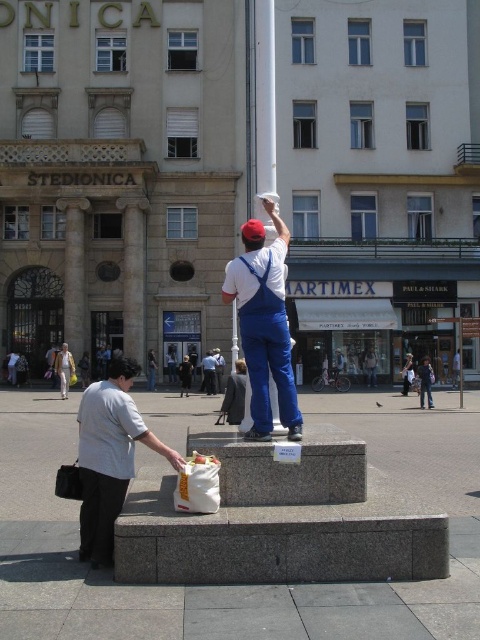
You are a delivery person who needs to place a package in the white fabric bag at lower left without disturbing the denim jacket at lower right. Can you do this based on their positions?

The white fabric bag at lower left is above the denim jacket at lower right, so you can place the package in the white fabric bag at lower left without disturbing the denim jacket at lower right since it is positioned higher up.

You are a delivery person who needs to carry both the white fabric bag at lower left and the denim jacket at lower right. Based on their sizes, which one should you place first in your delivery cart to ensure they both fit?

The white fabric bag at lower left might be wider than the denim jacket at lower right, so you should place the wider item first to ensure they both fit in the delivery cart.

You are a photographer trying to capture a clear shot of both the white cotton shirt at center and the white fabric bag at lower left. Which object should you focus on first to ensure it appears sharp in the photo?

You should focus on the white cotton shirt at center first because it is closer to you than the white fabric bag at lower left, ensuring it stays sharp while the background may blur slightly.